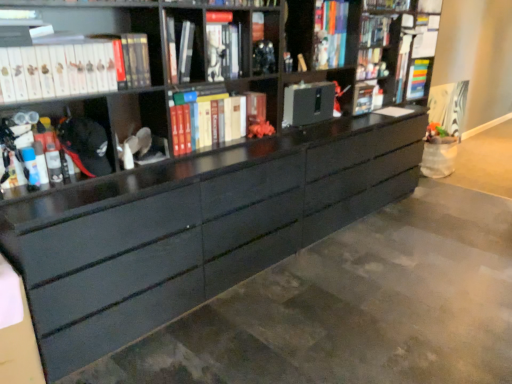
Question: Considering their positions, is hardcover books at center, acting as the 2th book starting from the back, located in front of or behind black matte cabinet at center, acting as the 2th cabinet starting from the left?

Choices:
 (A) front
 (B) behind

Answer: (A)

Question: Is point (264, 119) positioned closer to the camera than point (285, 114)?

Choices:
 (A) closer
 (B) farther

Answer: (A)

Question: Estimate the real-world distances between objects in this image. Which object is farther from the matte black book at upper center, acting as the 3th book starting from the right?

Choices:
 (A) white matte book at upper left, the 5th book when ordered from back to front
 (B) hardcover books at center, acting as the 2th book starting from the right
 (C) matte black cabinet at center, the 1th cabinet from the front
 (D) black matte cabinet at center, which appears as the 1th cabinet when viewed from the back
 (E) multicolored plastic book at upper right, the 1th book positioned from the back

Answer: (E)

Question: Which of these objects is positioned closest to the multicolored plastic book at upper right, the 1th book positioned from the back?

Choices:
 (A) matte black cabinet at center, acting as the second cabinet starting from the right
 (B) white matte book at upper left, the 1th book positioned from the front
 (C) matte black marker at left, arranged as the 4th book when viewed from the back
 (D) black matte cabinet at center, acting as the 2th cabinet starting from the left
 (E) hardcover books at center, arranged as the fourth book when viewed from the left

Answer: (D)